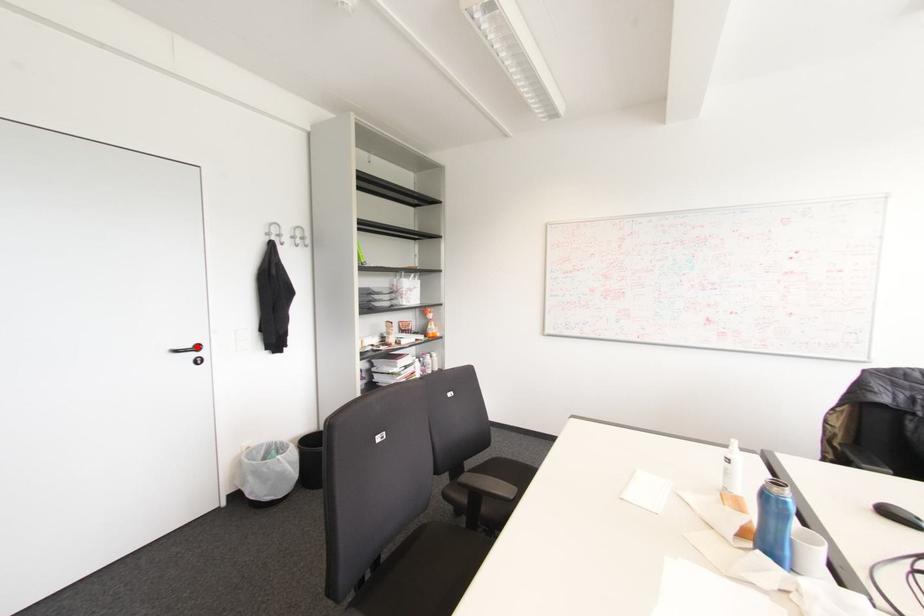
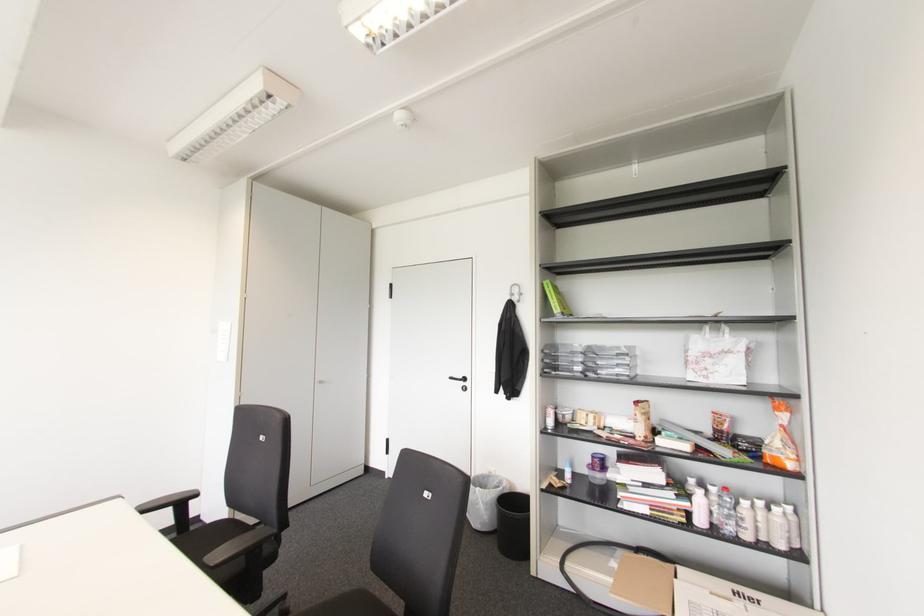
Find the pixel in the second image that matches the highlighted location in the first image.

(464, 379)